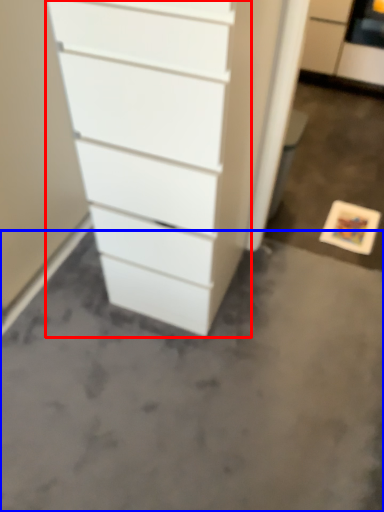
Question: Among these objects, which one is nearest to the camera, chest of drawers (highlighted by a red box) or concrete (highlighted by a blue box)?

Choices:
 (A) chest of drawers
 (B) concrete

Answer: (A)